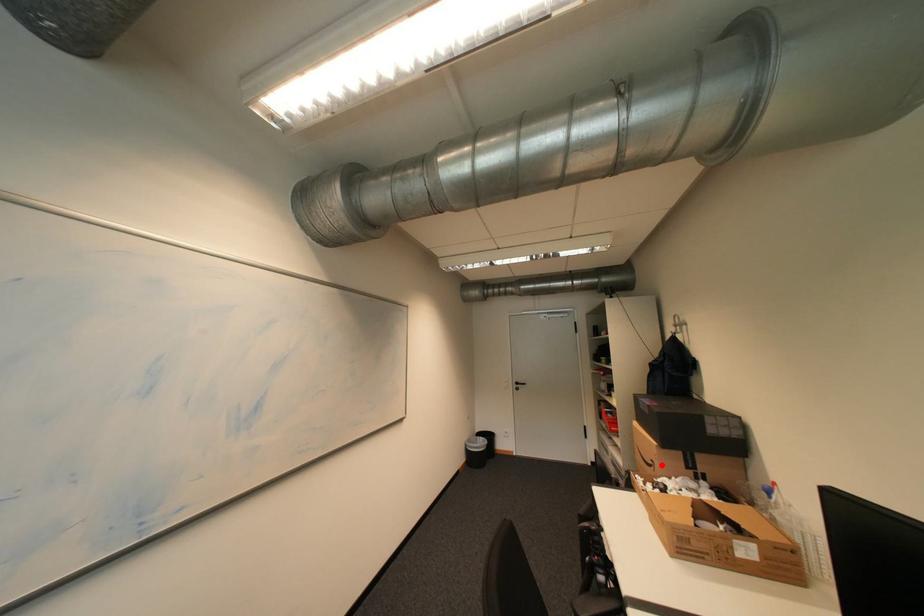
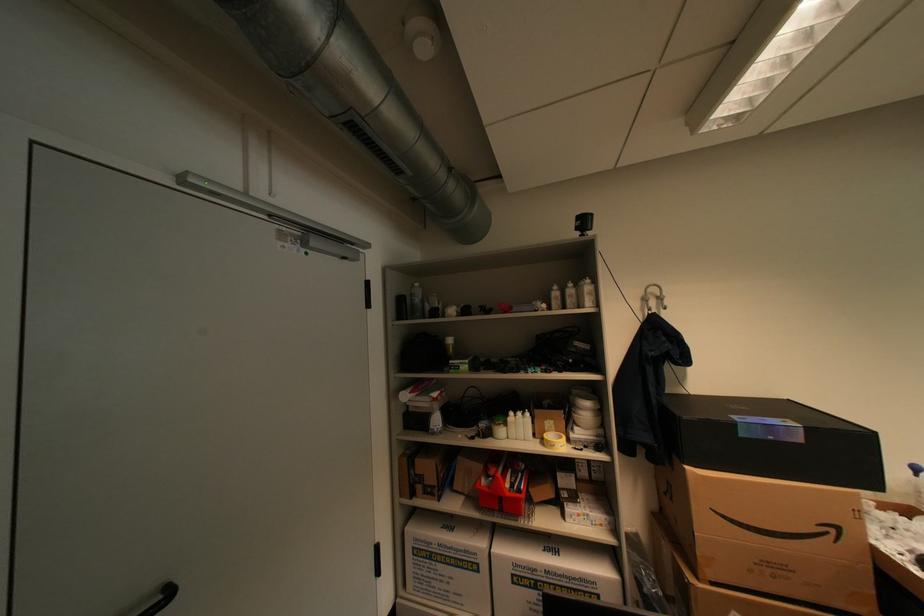
In the second image, find the point that corresponds to the highlighted location in the first image.

(841, 531)